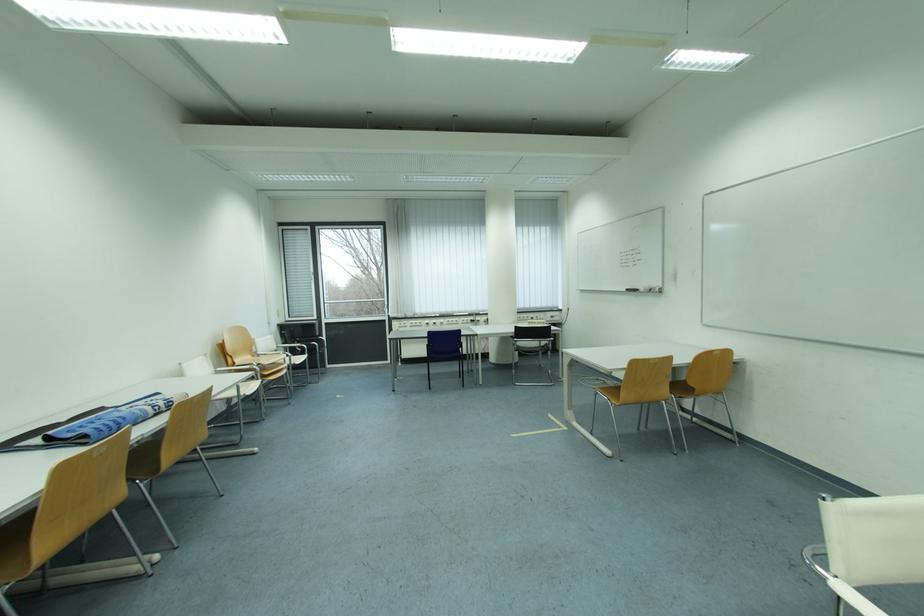
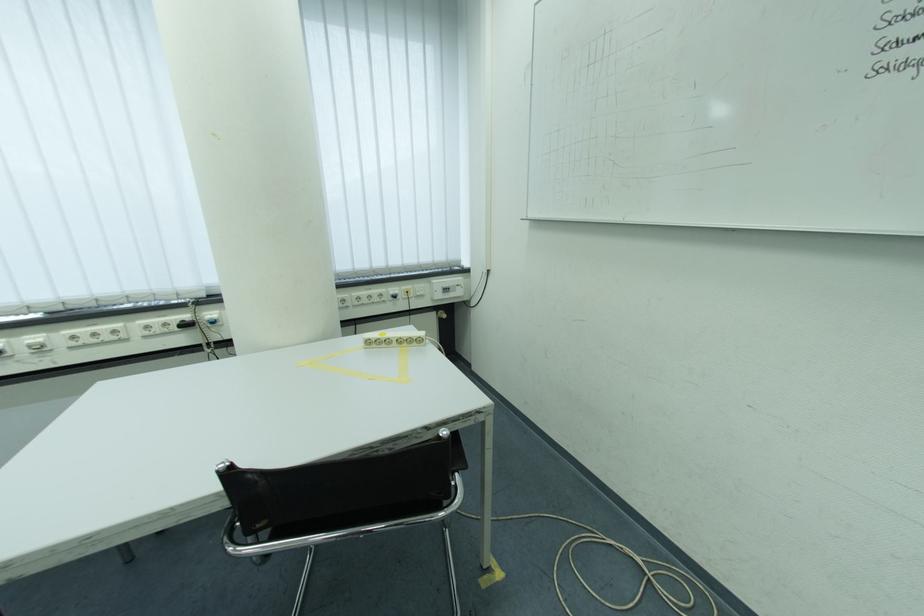
In the second image, find the point that corresponds to point (457, 323) in the first image.

(82, 339)